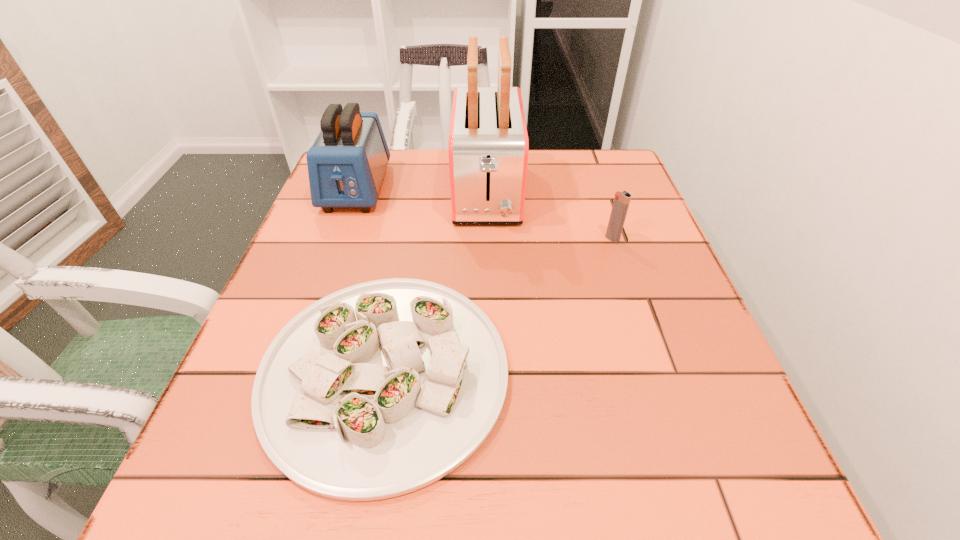
Locate an element on the screen. the tallest object is located at coordinates (488, 146).

In order to click on the taller toaster in this screenshot , I will do `click(488, 146)`.

At what (x,y) coordinates should I click in order to perform the action: click on the shorter toaster. Please return your answer as a coordinate pair (x, y). The height and width of the screenshot is (540, 960). Looking at the image, I should click on (346, 163).

The image size is (960, 540). What are the coordinates of `the left toaster` in the screenshot? It's located at (346, 163).

Locate an element on the screen. Image resolution: width=960 pixels, height=540 pixels. igniter is located at coordinates (622, 200).

You are a GUI agent. You are given a task and a screenshot of the screen. Output one action in this format:
    pyautogui.click(x=<x>, y=<y>)
    Task: Click on the third tallest object
    The width and height of the screenshot is (960, 540).
    Given the screenshot: What is the action you would take?
    pyautogui.click(x=622, y=200)

Find the location of `platter`. platter is located at coordinates (382, 388).

You are a GUI agent. You are given a task and a screenshot of the screen. Output one action in this format:
    pyautogui.click(x=<x>, y=<y>)
    Task: Click on the nearest object
    This screenshot has height=540, width=960.
    Given the screenshot: What is the action you would take?
    pyautogui.click(x=382, y=388)

Locate an element on the screen. The width and height of the screenshot is (960, 540). vacant space located on the front-facing side of the taller toaster is located at coordinates (489, 273).

The width and height of the screenshot is (960, 540). What are the coordinates of `vacant space situated on the front-facing side of the shorter toaster` in the screenshot? It's located at [x=302, y=336].